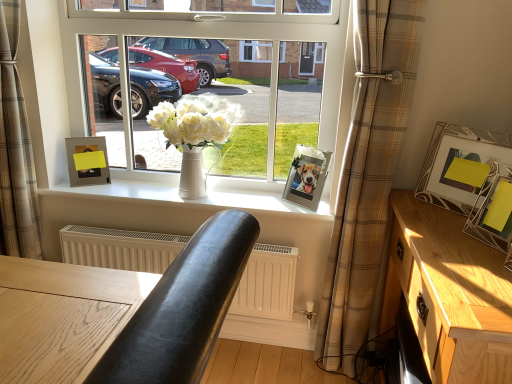
Question: Is yellow paper picture frame at right, which is counted as the 1th picture frame, starting from the front, bigger than wooden table at center, placed as the 1th table when sorted from front to back?

Choices:
 (A) yes
 (B) no

Answer: (B)

Question: Is yellow paper picture frame at right, the first picture frame from the right, further to the viewer compared to wooden table at center, which is the 2th table from right to left?

Choices:
 (A) yes
 (B) no

Answer: (A)

Question: Does yellow paper picture frame at right, the first picture frame from the right, appear on the right side of wooden table at center, positioned as the 1th table in left-to-right order?

Choices:
 (A) yes
 (B) no

Answer: (A)

Question: From the image's perspective, is yellow paper picture frame at right, the first picture frame from the right, below wooden table at center, placed as the 1th table when sorted from front to back?

Choices:
 (A) yes
 (B) no

Answer: (B)

Question: Is yellow paper picture frame at right, arranged as the fourth picture frame when viewed from the back, smaller than wooden table at center, positioned as the 1th table in left-to-right order?

Choices:
 (A) yes
 (B) no

Answer: (A)

Question: From a real-world perspective, is white ceramic vase at center physically located above or below yellow paper picture frame at right, the first picture frame from the right?

Choices:
 (A) below
 (B) above

Answer: (A)

Question: Considering the positions of white ceramic vase at center and yellow paper picture frame at right, which is counted as the 1th picture frame, starting from the front, in the image, is white ceramic vase at center bigger or smaller than yellow paper picture frame at right, which is counted as the 1th picture frame, starting from the front,?

Choices:
 (A) small
 (B) big

Answer: (B)

Question: Is white ceramic vase at center taller or shorter than yellow paper picture frame at right, which is counted as the 1th picture frame, starting from the front?

Choices:
 (A) short
 (B) tall

Answer: (B)

Question: Would you say white ceramic vase at center is to the left or to the right of yellow paper picture frame at right, the first picture frame from the right, in the picture?

Choices:
 (A) right
 (B) left

Answer: (B)

Question: Looking at the image, does white matte vase at center seem bigger or smaller compared to matte silver picture frame at upper left, which is the 4th picture frame from front to back?

Choices:
 (A) big
 (B) small

Answer: (A)

Question: Considering their positions, is white matte vase at center located in front of or behind matte silver picture frame at upper left, marked as the 1th picture frame in a back-to-front arrangement?

Choices:
 (A) front
 (B) behind

Answer: (A)

Question: From the image's perspective, is white matte vase at center above or below matte silver picture frame at upper left, which is counted as the 4th picture frame, starting from the right?

Choices:
 (A) above
 (B) below

Answer: (A)

Question: In the image, is white matte vase at center on the left side or the right side of matte silver picture frame at upper left, which is the 4th picture frame from front to back?

Choices:
 (A) right
 (B) left

Answer: (A)

Question: Based on their positions, is white smooth vase at center located to the left or right of beige plaid curtain at lower left, which ranks as the 2th curtain in right-to-left order?

Choices:
 (A) right
 (B) left

Answer: (A)

Question: Is white smooth vase at center inside or outside of beige plaid curtain at lower left, which ranks as the 2th curtain in right-to-left order?

Choices:
 (A) outside
 (B) inside

Answer: (A)